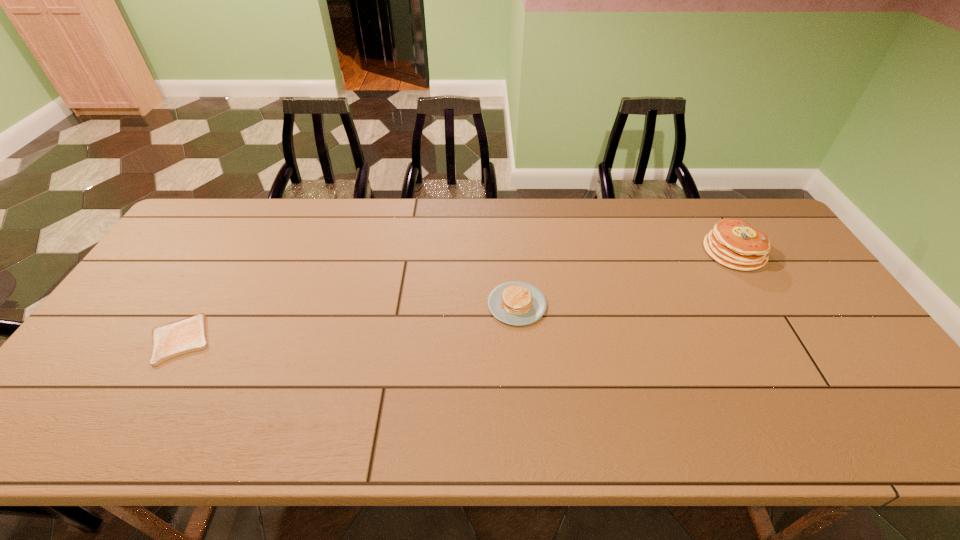
In order to click on object at the left edge in this screenshot , I will do `click(187, 335)`.

The image size is (960, 540). Identify the location of object located at the right edge. (733, 243).

Locate an element on the screen. Image resolution: width=960 pixels, height=540 pixels. object situated at the far right corner is located at coordinates (733, 243).

The image size is (960, 540). I want to click on vacant space at the far edge, so click(x=562, y=227).

This screenshot has width=960, height=540. What are the coordinates of `vacant area at the near edge of the desktop` in the screenshot? It's located at (696, 433).

The width and height of the screenshot is (960, 540). In order to click on free space at the right edge of the desktop in this screenshot , I will do `click(795, 274)`.

What are the coordinates of `vacant space at the far left corner of the desktop` in the screenshot? It's located at (206, 208).

The width and height of the screenshot is (960, 540). In the image, there is a desktop. What are the coordinates of `vacant space at the far right corner` in the screenshot? It's located at (744, 215).

Locate an element on the screen. vacant space at the near right corner is located at coordinates (914, 444).

Identify the location of free space that is in between the shortest object and the shorter pancake. This screenshot has width=960, height=540. (348, 322).